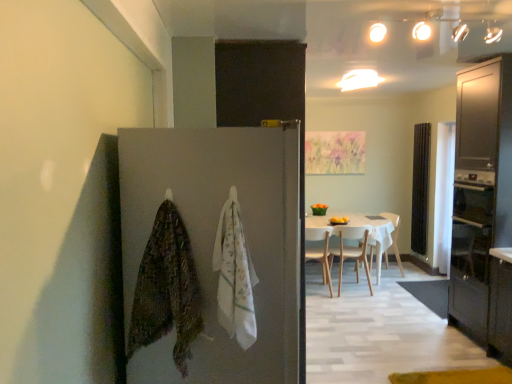
Question: Can you confirm if black wood screen door at right is smaller than black glass oven at right?

Choices:
 (A) no
 (B) yes

Answer: (B)

Question: Is black wood screen door at right aimed at black glass oven at right?

Choices:
 (A) no
 (B) yes

Answer: (A)

Question: Does black wood screen door at right have a greater height compared to black glass oven at right?

Choices:
 (A) no
 (B) yes

Answer: (B)

Question: Is black wood screen door at right oriented away from black glass oven at right?

Choices:
 (A) no
 (B) yes

Answer: (A)

Question: Is black wood screen door at right outside black glass oven at right?

Choices:
 (A) yes
 (B) no

Answer: (A)

Question: From a real-world perspective, is black wood screen door at right under black glass oven at right?

Choices:
 (A) no
 (B) yes

Answer: (A)

Question: From a real-world perspective, is matte dark wood cabinet at right under white cotton towel at center, the 1th blanket in the right-to-left sequence?

Choices:
 (A) yes
 (B) no

Answer: (A)

Question: Is matte dark wood cabinet at right completely or partially outside of white cotton towel at center, the 1th blanket in the right-to-left sequence?

Choices:
 (A) no
 (B) yes

Answer: (B)

Question: From the image's perspective, is matte dark wood cabinet at right below white cotton towel at center, the 1th blanket in the right-to-left sequence?

Choices:
 (A) no
 (B) yes

Answer: (A)

Question: Can you confirm if matte dark wood cabinet at right is wider than white cotton towel at center, the 1th blanket in the right-to-left sequence?

Choices:
 (A) yes
 (B) no

Answer: (A)

Question: Is matte dark wood cabinet at right looking in the opposite direction of white cotton towel at center, arranged as the 2th blanket when viewed from the left?

Choices:
 (A) yes
 (B) no

Answer: (B)

Question: Is white cotton towel at center, the 1th blanket in the right-to-left sequence, completely or partially inside matte dark wood cabinet at right?

Choices:
 (A) yes
 (B) no

Answer: (B)

Question: Is white wood chair at center, the third chair when ordered from left to right, inside matte dark wood cabinet at right?

Choices:
 (A) no
 (B) yes

Answer: (A)